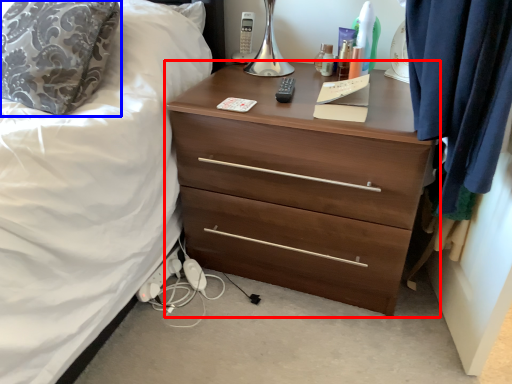
Question: Which point is further to the camera, chest of drawers (highlighted by a red box) or pillow (highlighted by a blue box)?

Choices:
 (A) chest of drawers
 (B) pillow

Answer: (B)